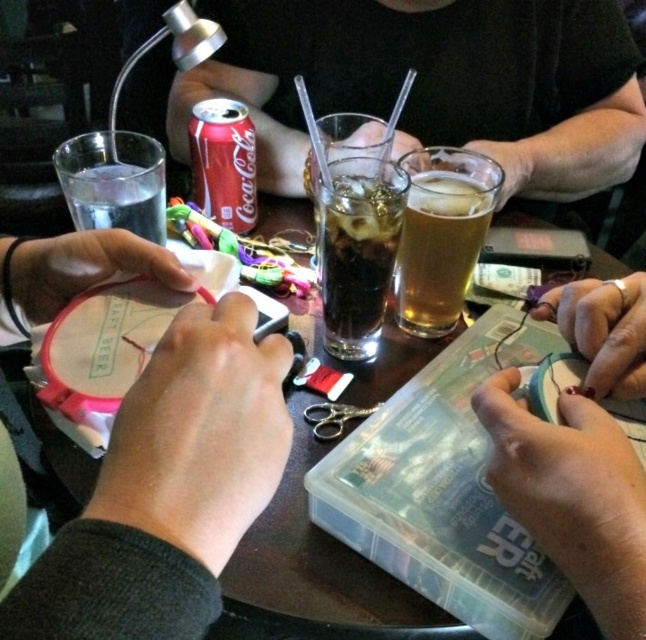
Question: Based on their relative distances, which object is farther from the translucent glass beer at center?

Choices:
 (A) clear glass water at left
 (B) smooth black shirt at upper center
 (C) pink fabric hoop at center

Answer: (B)

Question: From the image, what is the correct spatial relationship of pink fabric hoop at center in relation to clear glass water at left?

Choices:
 (A) above
 (B) below

Answer: (B)

Question: Which object is farther from the camera taking this photo?

Choices:
 (A) pink fabric hoop at center
 (B) smooth black shirt at upper center
 (C) clear glass water at left
 (D) translucent glass beer at center

Answer: (B)

Question: Where is translucent glass beer at center located in relation to clear glass water at left in the image?

Choices:
 (A) left
 (B) right

Answer: (B)

Question: Is pink fabric hoop at center above translucent glass beer at center?

Choices:
 (A) no
 (B) yes

Answer: (A)

Question: Which point appears closest to the camera in this image?

Choices:
 (A) (70, 172)
 (B) (61, 552)
 (C) (585, 179)
 (D) (441, 291)

Answer: (B)